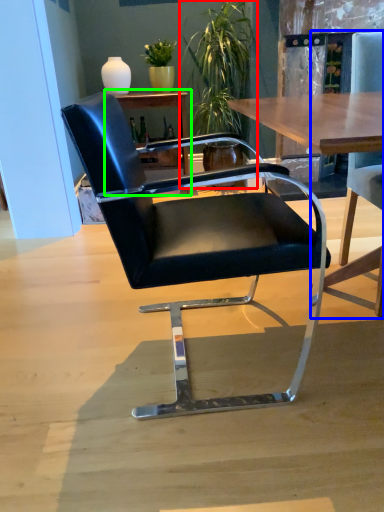
Question: Which object is the closest to the houseplant (highlighted by a red box)? Choose among these: chair (highlighted by a blue box) or table (highlighted by a green box).

Choices:
 (A) chair
 (B) table

Answer: (B)